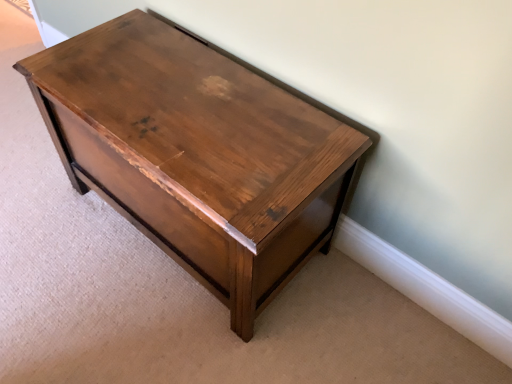
Find the location of a particular element. vacant area to the left of shiny brown wood chest at center is located at coordinates (52, 220).